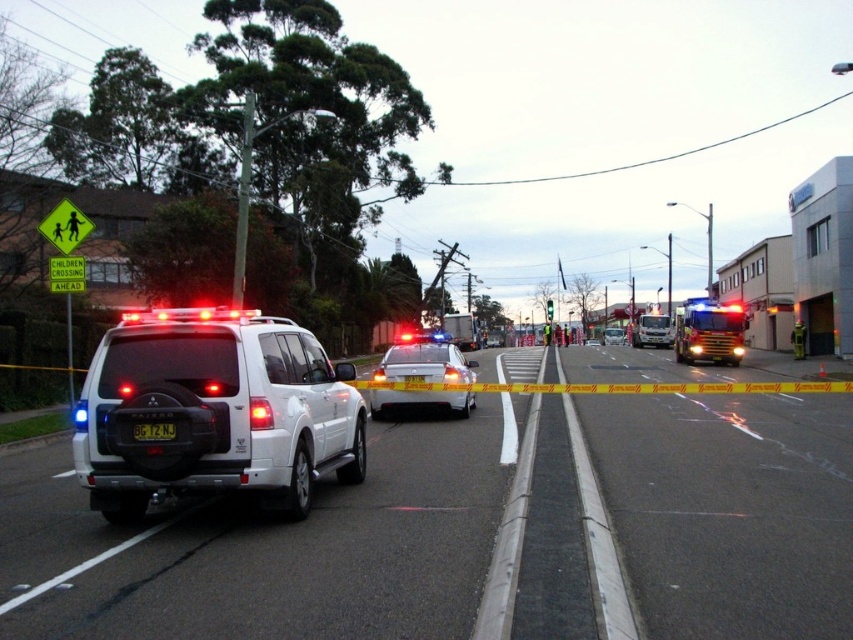
You are a delivery driver who needs to navigate through the road blocked by the caution tape. You see a shiny silver sedan at center and a white glossy sedan at center. Which car is narrower so you can pass through the gap between them?

The shiny silver sedan at center is narrower than the white glossy sedan at center, so you can pass through the gap between them.